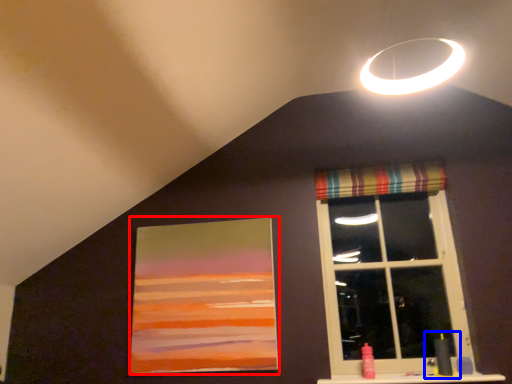
Question: Among these objects, which one is nearest to the camera, picture frame (highlighted by a red box) or sink (highlighted by a blue box)?

Choices:
 (A) picture frame
 (B) sink

Answer: (B)